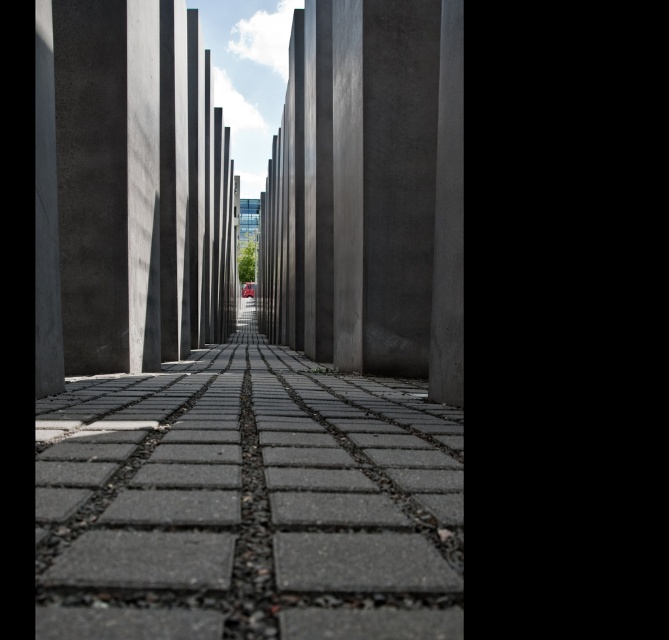
You are a construction worker standing at the base of the smooth concrete pillar at center. You need to place a heavy equipment that requires a stable surface 12 meters away from the pillar. Can you use the gray concrete pavement at center for this purpose?

The gray concrete pavement at center is exactly 12.03 meters from the smooth concrete pillar at center, so it can be used as the stable surface for placing the heavy equipment since it meets the required distance.

You are standing in front of the architectural structure and notice two pillars labeled as the sleek concrete pillar at center and the smooth concrete pillar at center. Which pillar would block your view of the other when looking straight ahead?

The sleek concrete pillar at center is in front of the smooth concrete pillar at center, so it would block your view of the smooth concrete pillar at center when looking straight ahead.

You are standing at the entrance of the architectural structure and want to reach the gray concrete pavement at center. Based on your current position, which direction should you move to reach it?

Since the gray concrete pavement at center is located at point 0.786 on the x axis and 0.371 on the y axis, you should move forward and slightly to the right to reach it.